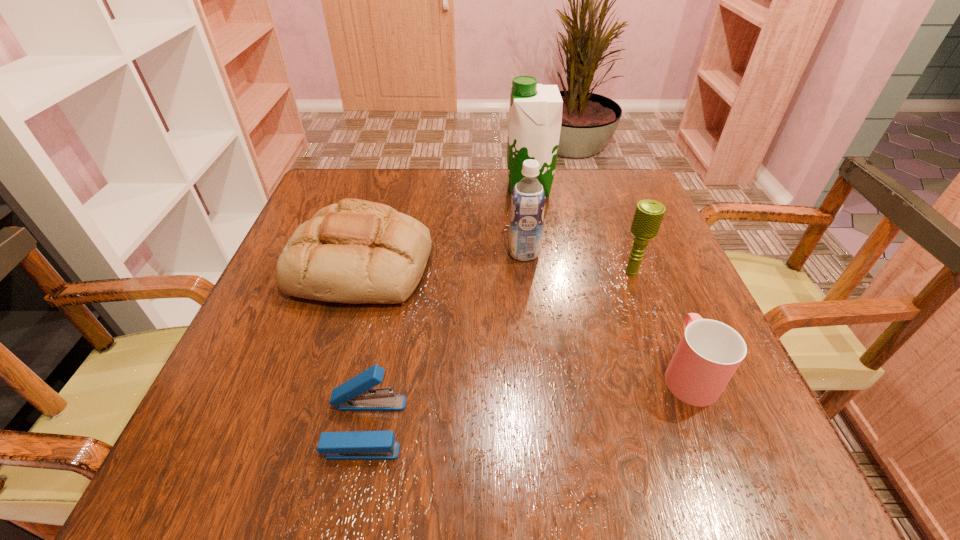
You are a GUI agent. You are given a task and a screenshot of the screen. Output one action in this format:
    pyautogui.click(x=<x>, y=<y>)
    Task: Click on the unoccupied position between the second tallest object and the bread
    
    Given the screenshot: What is the action you would take?
    pyautogui.click(x=444, y=259)

Identify the location of vacant area that lies between the shortest object and the nearer soya milk. Image resolution: width=960 pixels, height=540 pixels. (444, 340).

The height and width of the screenshot is (540, 960). Find the location of `blank region between the shorter soya milk and the fifth tallest object`. blank region between the shorter soya milk and the fifth tallest object is located at coordinates (606, 313).

This screenshot has height=540, width=960. Identify the location of free space that is in between the farther soya milk and the third shortest object. (445, 226).

This screenshot has height=540, width=960. I want to click on free space between the shortest object and the fifth tallest object, so click(526, 400).

Locate an element on the screen. free spot between the fifth shortest object and the microphone is located at coordinates (578, 262).

Find the location of a particular element. vacant space in between the second shortest object and the farthest object is located at coordinates (609, 280).

What are the coordinates of `free point between the third shortest object and the stapler` in the screenshot? It's located at (364, 346).

You are a GUI agent. You are given a task and a screenshot of the screen. Output one action in this format:
    pyautogui.click(x=<x>, y=<y>)
    Task: Click on the free spot between the farther soya milk and the fourth shortest object
    This screenshot has height=540, width=960.
    Given the screenshot: What is the action you would take?
    pyautogui.click(x=581, y=230)

I want to click on object that is the second nearest to the fourth shortest object, so click(528, 198).